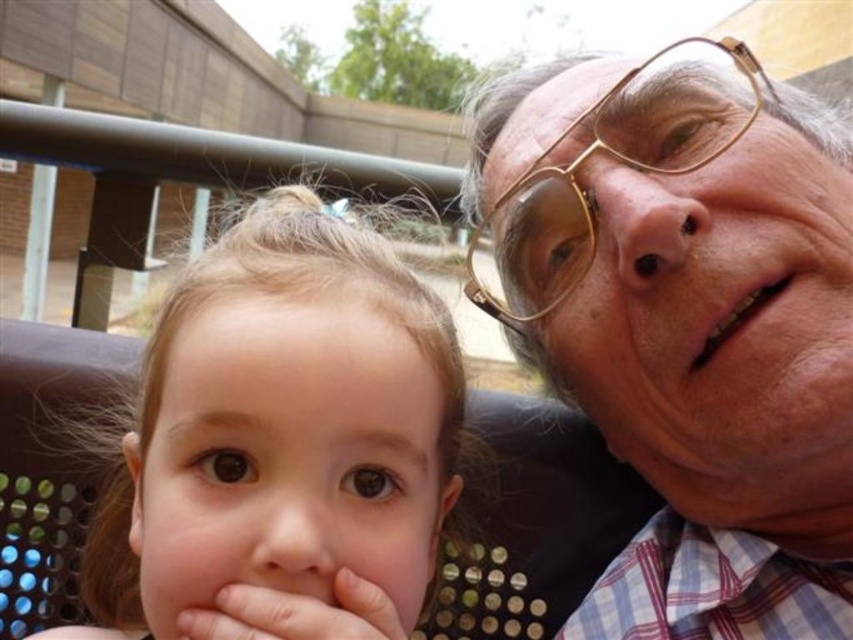
Question: Which object is the farthest from the smooth skin baby at center?

Choices:
 (A) matte gold glasses at upper right
 (B) pink flesh hand at lower left

Answer: (A)

Question: Is matte gold glasses at upper right positioned at the back of smooth skin baby at center?

Choices:
 (A) no
 (B) yes

Answer: (B)

Question: Estimate the real-world distances between objects in this image. Which object is farther from the gold metallic glasses at upper right?

Choices:
 (A) smooth skin baby at center
 (B) matte gold glasses at upper right
 (C) pink flesh hand at lower left

Answer: (C)

Question: Which point is farther to the camera?

Choices:
 (A) smooth skin baby at center
 (B) matte gold glasses at upper right
 (C) gold metallic glasses at upper right

Answer: (C)

Question: Is matte gold glasses at upper right to the left of smooth skin baby at center from the viewer's perspective?

Choices:
 (A) no
 (B) yes

Answer: (A)

Question: Can you confirm if matte gold glasses at upper right is thinner than pink flesh hand at lower left?

Choices:
 (A) yes
 (B) no

Answer: (B)